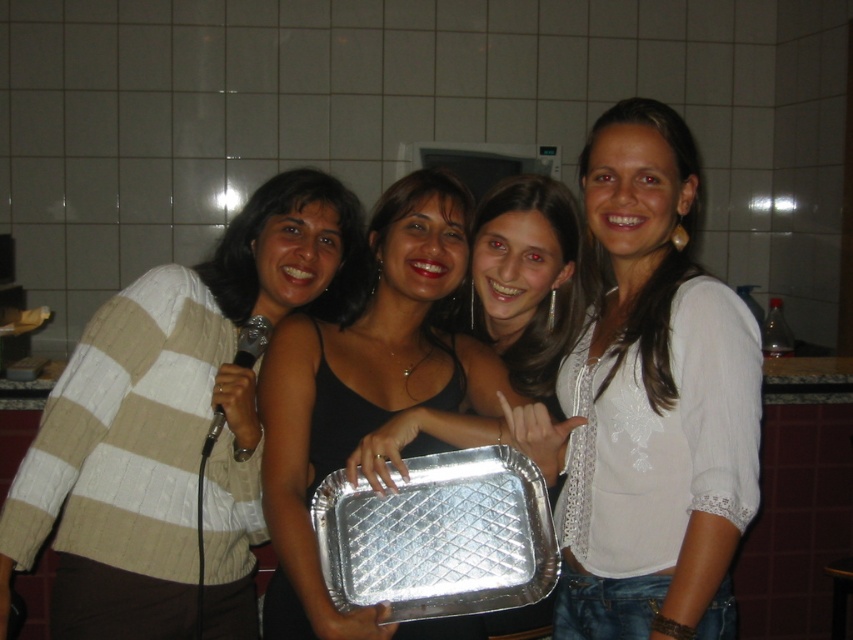
Question: Which of the following is the closest to the observer?

Choices:
 (A) white embroidered shirt at center
 (B) white knit sweater at left
 (C) silver/aluminum tray at center
 (D) metallic silver tray at center

Answer: (A)

Question: Which point is farther from the camera taking this photo?

Choices:
 (A) (392, 444)
 (B) (509, 588)

Answer: (B)

Question: From the image, what is the correct spatial relationship of white knit sweater at left in relation to white embroidered shirt at center?

Choices:
 (A) right
 (B) left

Answer: (B)

Question: Which of the following is the closest to the observer?

Choices:
 (A) silver/aluminum tray at center
 (B) metallic silver tray at center
 (C) white knit sweater at left
 (D) white embroidered shirt at center

Answer: (D)

Question: Can you confirm if white embroidered shirt at center is positioned below metallic silver tray at center?

Choices:
 (A) yes
 (B) no

Answer: (B)

Question: Is white knit sweater at left to the right of white embroidered shirt at center from the viewer's perspective?

Choices:
 (A) no
 (B) yes

Answer: (A)